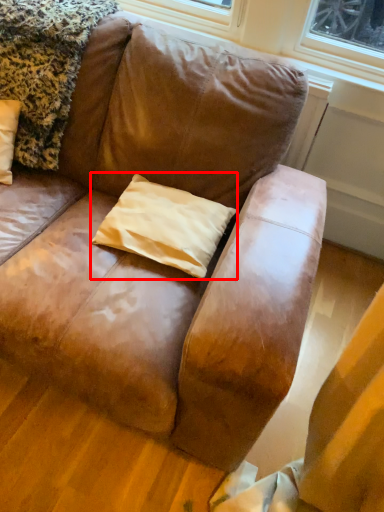
Question: Considering the relative positions of pillow (annotated by the red box) and blanket in the image provided, where is pillow (annotated by the red box) located with respect to the staircase?

Choices:
 (A) right
 (B) left

Answer: (A)